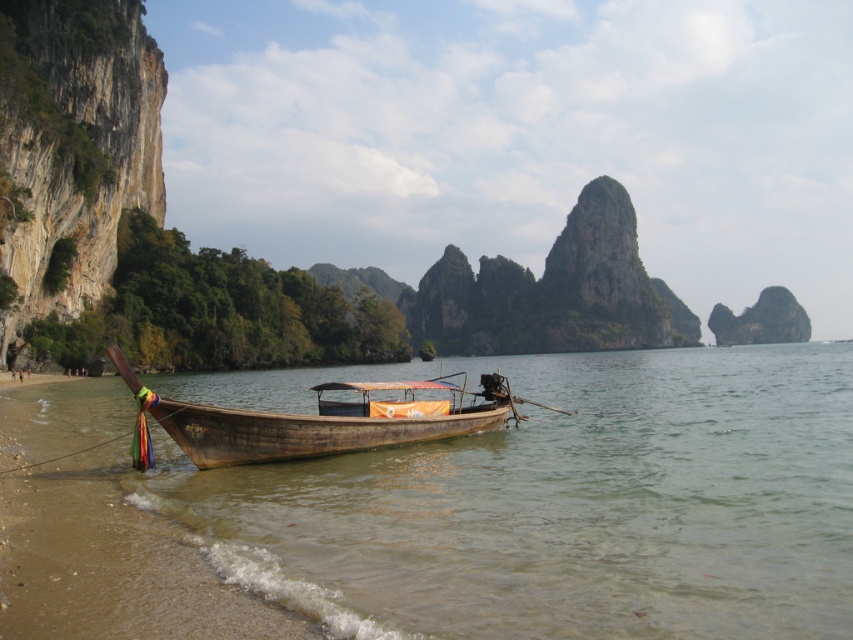
Question: Which object is closer to the camera taking this photo?

Choices:
 (A) wooden longboat at center
 (B) brown wooden water at lower left

Answer: (B)

Question: Where is brown wooden water at lower left located in relation to wooden longboat at center in the image?

Choices:
 (A) below
 (B) above

Answer: (A)

Question: Can you confirm if brown wooden water at lower left is positioned below wooden longboat at center?

Choices:
 (A) yes
 (B) no

Answer: (A)

Question: Can you confirm if brown wooden water at lower left is thinner than wooden longboat at center?

Choices:
 (A) no
 (B) yes

Answer: (A)